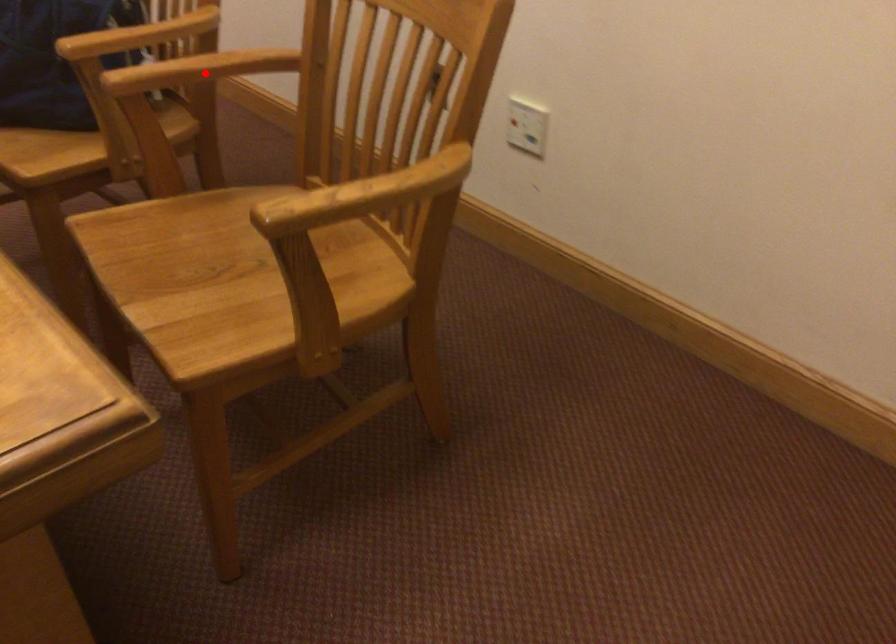
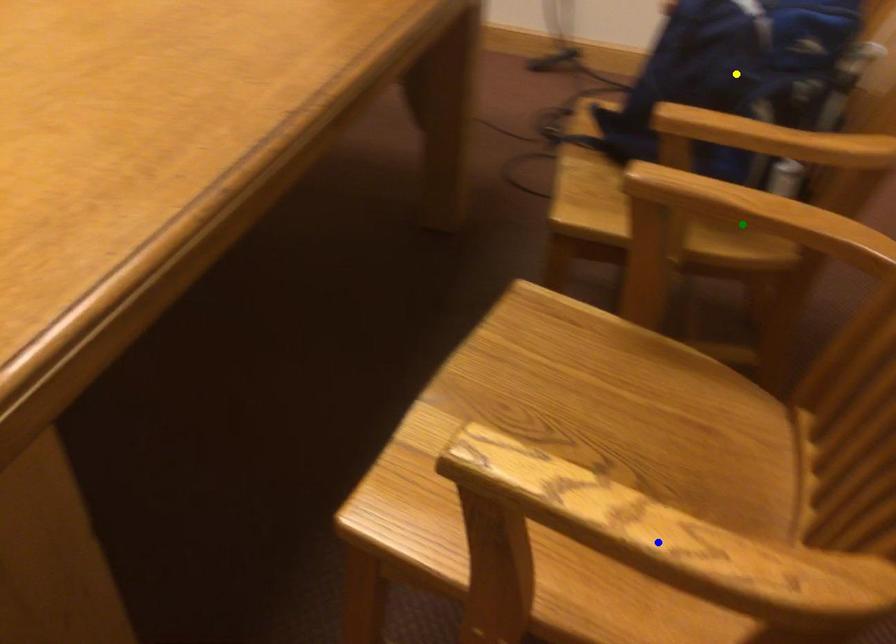
Question: I am providing you with two images of the same scene from different viewpoints. A red point is marked on the first image. You are given multiple points on the second image. In image 2, which mark is for the same physical point as the one in image 1?

Choices:
 (A) blue point
 (B) yellow point
 (C) green point

Answer: (C)